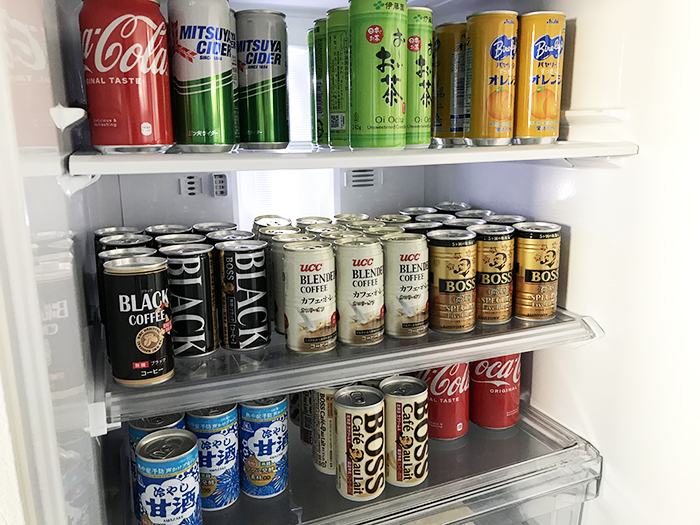
Where is `fridge`? This screenshot has width=700, height=525. fridge is located at coordinates [x=54, y=204].